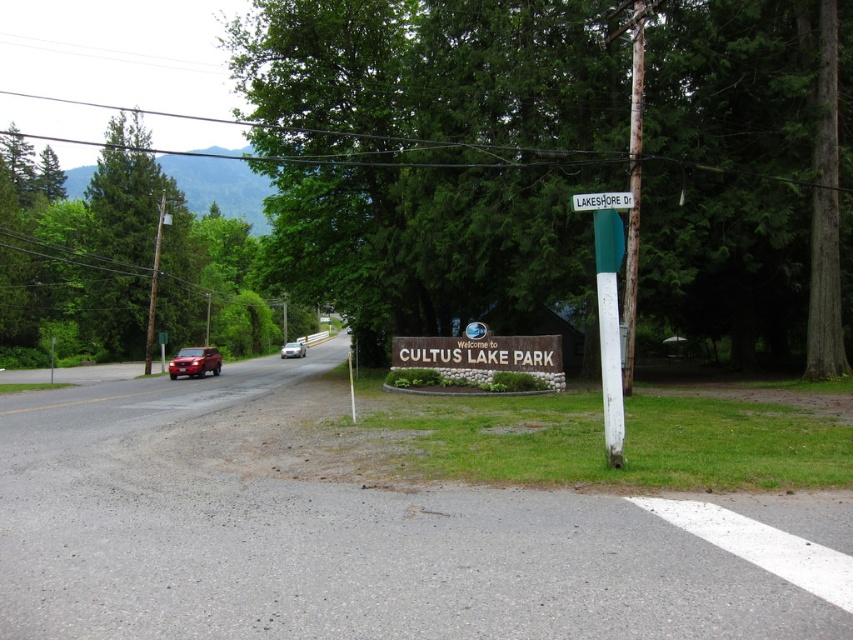
Question: Does green plastic signpost at center-right have a lesser width compared to satin silver sedan at center?

Choices:
 (A) yes
 (B) no

Answer: (A)

Question: In this image, where is green plastic signpost at center-right located relative to white plastic street sign at upper center?

Choices:
 (A) below
 (B) above

Answer: (A)

Question: Estimate the real-world distances between objects in this image. Which object is closer to the green plastic signpost at center-right?

Choices:
 (A) satin silver sedan at center
 (B) matte red suv at left
 (C) white plastic street sign at upper center
 (D) brown wooden sign at center

Answer: (C)

Question: Considering the real-world distances, which object is farthest from the matte red suv at left?

Choices:
 (A) white plastic street sign at upper center
 (B) green plastic signpost at center-right
 (C) satin silver sedan at center
 (D) brown wooden sign at center

Answer: (B)

Question: Is green plastic signpost at center-right above matte red suv at left?

Choices:
 (A) no
 (B) yes

Answer: (B)

Question: Which point is closer to the camera?

Choices:
 (A) (612, 284)
 (B) (599, 198)
 (C) (293, 344)
 (D) (184, 349)

Answer: (A)